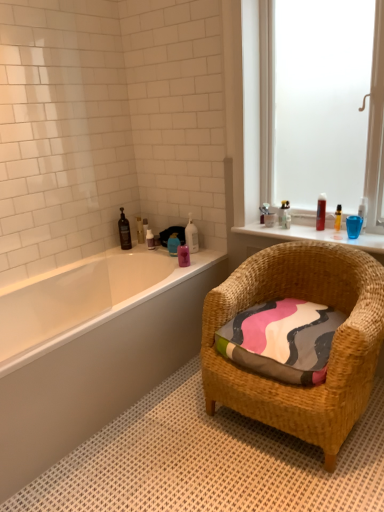
The image size is (384, 512). I want to click on vacant area that lies in front of translucent plastic bottle at upper left, the eighth toiletry in the right-to-left sequence, so click(x=145, y=245).